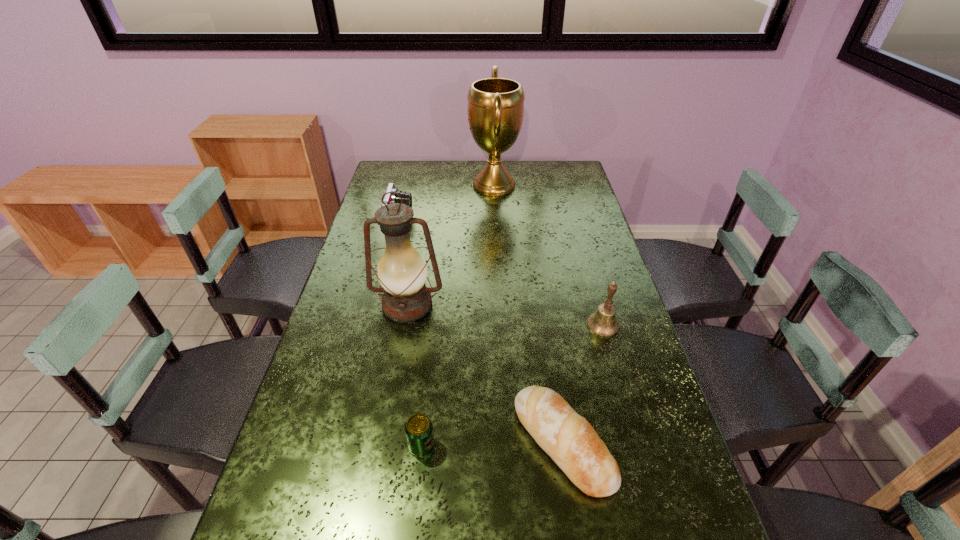
Image resolution: width=960 pixels, height=540 pixels. In order to click on blank region between the trophy cup and the beer can in this screenshot , I will do `click(458, 315)`.

Where is `vacant space that is in between the bread and the fourth tallest object`? The image size is (960, 540). vacant space that is in between the bread and the fourth tallest object is located at coordinates (481, 332).

Identify the location of free space between the trophy cup and the bread. (528, 314).

Select which object appears as the third closest to the camera. Please provide its 2D coordinates. Your answer should be formatted as a tuple, i.e. [(x, y)], where the tuple contains the x and y coordinates of a point satisfying the conditions above.

[(603, 323)]

This screenshot has height=540, width=960. I want to click on object identified as the second closest to the rightmost object, so click(x=402, y=272).

You are a GUI agent. You are given a task and a screenshot of the screen. Output one action in this format:
    pyautogui.click(x=<x>, y=<y>)
    Task: Click on the free region that satisfies the following two spatial constraints: 1. on the front-facing side of the third shortest object; 2. on the back side of the bread
    Image resolution: width=960 pixels, height=540 pixels.
    Given the screenshot: What is the action you would take?
    pyautogui.click(x=346, y=443)

Identify the location of free space in the image that satisfies the following two spatial constraints: 1. on the surface of the trophy cup with symbols; 2. on the back side of the bell. The image size is (960, 540). (500, 325).

Where is `vacant space that satisfies the following two spatial constraints: 1. on the front-facing side of the bread; 2. on the left side of the camera`? This screenshot has width=960, height=540. vacant space that satisfies the following two spatial constraints: 1. on the front-facing side of the bread; 2. on the left side of the camera is located at coordinates (346, 443).

Locate an element on the screen. vacant space that satisfies the following two spatial constraints: 1. on the surface of the trophy cup with symbols; 2. on the front side of the oil lamp is located at coordinates (499, 305).

Identify the location of free space that satisfies the following two spatial constraints: 1. on the surface of the trophy cup with symbols; 2. on the front side of the oil lamp. (499, 305).